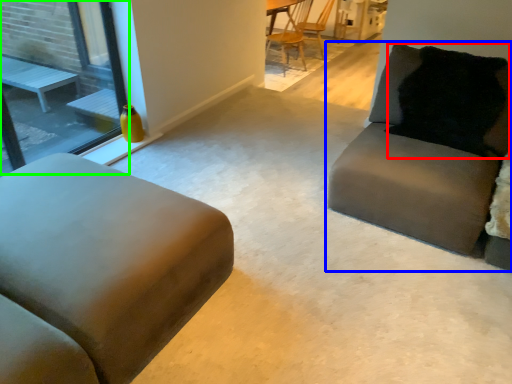
Question: Which object is the closest to the pillow (highlighted by a red box)? Choose among these: studio couch (highlighted by a blue box) or window (highlighted by a green box).

Choices:
 (A) studio couch
 (B) window

Answer: (A)